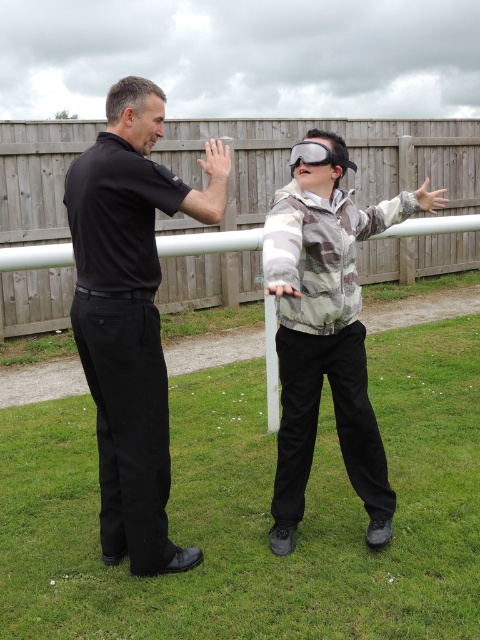
How distant is black smooth shirt at left from satin black goggles at upper center?

3.86 feet

Locate an element on the screen. black smooth shirt at left is located at coordinates (131, 316).

Locate an element on the screen. This screenshot has width=480, height=640. black smooth shirt at left is located at coordinates (131, 316).

Consider the image. Can you confirm if camouflage jacket at center is thinner than satin black goggles at upper center?

In fact, camouflage jacket at center might be wider than satin black goggles at upper center.

How far apart are camouflage jacket at center and satin black goggles at upper center?

camouflage jacket at center and satin black goggles at upper center are 36.46 inches apart.

Find the location of `camouflage jacket at center`. camouflage jacket at center is located at coordinates (325, 339).

Measure the distance between point [189,556] and camera.

They are 10.90 feet apart.

Who is shorter, black smooth shirt at left or camouflage jacket at center?

camouflage jacket at center

Which is in front, point (141, 300) or point (322, 176)?

Point (141, 300)

Image resolution: width=480 pixels, height=640 pixels. What are the coordinates of `black smooth shirt at left` in the screenshot? It's located at (131, 316).